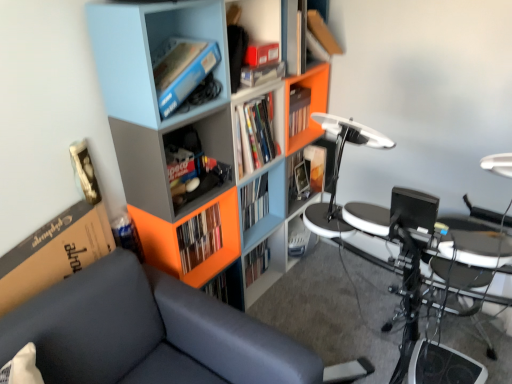
What is the approximate height of matte plastic book at center, the second book from the left?

It is 9.52 inches.

What are the coordinates of `matte plastic book at center, which appears as the 1th book when viewed from the right` in the screenshot? It's located at (316, 166).

What is the approximate height of matte blue bookshelf at upper left, which is the second shelf from bottom to top?

9.31 inches.

The image size is (512, 384). In order to click on matte cardboard box at upper center, which is the first shelf from top to bottom in this screenshot , I will do `click(260, 20)`.

Find the location of a particular element. metallic silver drum set at lower right is located at coordinates (417, 273).

The width and height of the screenshot is (512, 384). I want to click on matte plastic book at center, the second book from the left, so click(316, 166).

Does matte plastic cabinet at center have a smaller size compared to matte plastic bookcase at upper left?

Yes.

How many degrees apart are the facing directions of matte plastic cabinet at center and matte plastic bookcase at upper left?

The facing directions of matte plastic cabinet at center and matte plastic bookcase at upper left are 0.586 degrees apart.

Which point is more distant from viewer, (x=286, y=231) or (x=101, y=34)?

The point (x=286, y=231) is farther.

Is matte plastic cabinet at center not inside matte plastic bookcase at upper left?

That's incorrect, matte plastic cabinet at center is not completely outside matte plastic bookcase at upper left.

Looking at this image, considering the sizes of dark gray fabric couch at left and matte plastic bookcase at upper left in the image, is dark gray fabric couch at left taller or shorter than matte plastic bookcase at upper left?

Clearly, dark gray fabric couch at left is shorter compared to matte plastic bookcase at upper left.

Which object is wider, dark gray fabric couch at left or matte plastic bookcase at upper left?

dark gray fabric couch at left.

From a real-world perspective, does dark gray fabric couch at left sit lower than matte plastic bookcase at upper left?

Yes, from a real-world perspective, dark gray fabric couch at left is under matte plastic bookcase at upper left.

Is matte plastic book at center, the second book from the left, placed right next to orange matte bookshelf at center, placed as the 2th book when sorted from back to front?

No, matte plastic book at center, the second book from the left, is not making contact with orange matte bookshelf at center, placed as the 2th book when sorted from back to front.

Considering the relative sizes of matte plastic book at center, the second book from the left, and orange matte bookshelf at center, the first book ordered from the bottom, in the image provided, is matte plastic book at center, the second book from the left, shorter than orange matte bookshelf at center, the first book ordered from the bottom,?

Yes, matte plastic book at center, the second book from the left, is shorter than orange matte bookshelf at center, the first book ordered from the bottom.

Is matte plastic book at center, which appears as the 1th book when viewed from the right, wider than orange matte bookshelf at center, which ranks as the 1th book in left-to-right order?

Yes, matte plastic book at center, which appears as the 1th book when viewed from the right, is wider than orange matte bookshelf at center, which ranks as the 1th book in left-to-right order.

Is matte plastic book at center, the second book from the left, looking in the opposite direction of orange matte bookshelf at center, which ranks as the 1th book in left-to-right order?

matte plastic book at center, the second book from the left, is not turned away from orange matte bookshelf at center, which ranks as the 1th book in left-to-right order.

Considering the positions of objects metallic silver drum set at lower right and dark gray fabric couch at left in the image provided, who is in front, metallic silver drum set at lower right or dark gray fabric couch at left?

dark gray fabric couch at left.

Looking at the image, does metallic silver drum set at lower right seem bigger or smaller compared to dark gray fabric couch at left?

In the image, metallic silver drum set at lower right appears to be smaller than dark gray fabric couch at left.

Is dark gray fabric couch at left completely or partially inside metallic silver drum set at lower right?

No, dark gray fabric couch at left is not a part of metallic silver drum set at lower right.

Can you tell me how much dark gray fabric couch at left and matte plastic cabinet at center differ in facing direction?

The angle between the facing direction of dark gray fabric couch at left and the facing direction of matte plastic cabinet at center is 1.5 degrees.

From the image's perspective, which object appears higher, dark gray fabric couch at left or matte plastic cabinet at center?

matte plastic cabinet at center appears higher in the image.

Which is correct: dark gray fabric couch at left is inside matte plastic cabinet at center, or outside of it?

dark gray fabric couch at left is not enclosed by matte plastic cabinet at center.

At what (x,y) coordinates should I click in order to perform the action: click on chair on the left of matte plastic cabinet at center. Please return your answer as a coordinate pair (x, y). This screenshot has width=512, height=384. Looking at the image, I should click on (148, 333).

Is the position of orange matte bookshelf at center, the 1th book positioned from the front, less distant than that of metallic silver drum set at lower right?

No.

Considering the relative sizes of orange matte bookshelf at center, the first book ordered from the bottom, and metallic silver drum set at lower right in the image provided, is orange matte bookshelf at center, the first book ordered from the bottom, taller than metallic silver drum set at lower right?

Indeed, orange matte bookshelf at center, the first book ordered from the bottom, has a greater height compared to metallic silver drum set at lower right.

Measure the distance from orange matte bookshelf at center, placed as the 2th book when sorted from back to front, to metallic silver drum set at lower right.

orange matte bookshelf at center, placed as the 2th book when sorted from back to front, and metallic silver drum set at lower right are 69.17 centimeters apart.

From the picture: Which object is thinner, orange matte bookshelf at center, placed as the 2th book when sorted from back to front, or metallic silver drum set at lower right?

With smaller width is orange matte bookshelf at center, placed as the 2th book when sorted from back to front.

Between matte plastic book at center, which is the first book from top to bottom, and matte cardboard box at upper center, the 3th shelf from the bottom, which one has larger size?

Bigger between the two is matte cardboard box at upper center, the 3th shelf from the bottom.

Does point (310, 180) lie in front of point (256, 28)?

No, it is behind (256, 28).

Is matte plastic book at center, which is the first book from top to bottom, positioned with its back to matte cardboard box at upper center, which is the first shelf from top to bottom?

No.

Can we say matte plastic book at center, which is the first book from top to bottom, lies outside matte cardboard box at upper center, the 3th shelf from the bottom?

Yes, matte plastic book at center, which is the first book from top to bottom, is not within matte cardboard box at upper center, the 3th shelf from the bottom.

Where is `cabinet located behind the matte plastic bookcase at upper left`? cabinet located behind the matte plastic bookcase at upper left is located at coordinates (300, 233).

I want to click on bookcase that is above the dark gray fabric couch at left (from a real-world perspective), so (x=181, y=135).

From the image, which object appears to be farther from orange matte bookshelf at center, which ranks as the 1th book in left-to-right order, matte plastic shelf at center, the 1th shelf positioned from the bottom, or metallic silver drum set at lower right?

metallic silver drum set at lower right is positioned further to the anchor orange matte bookshelf at center, which ranks as the 1th book in left-to-right order.

When comparing their distances from matte plastic book at center, arranged as the 1th book when viewed from the back, does matte plastic shelf at center, which ranks as the 3th shelf in top-to-bottom order, or dark gray fabric couch at left seem further?

dark gray fabric couch at left lies further to matte plastic book at center, arranged as the 1th book when viewed from the back, than the other object.

Which object lies nearer to the anchor point matte plastic cabinet at center, matte plastic shelf at center, the 1th shelf positioned from the bottom, or orange matte bookshelf at center, the second book from the top?

Based on the image, orange matte bookshelf at center, the second book from the top, appears to be nearer to matte plastic cabinet at center.

From the image, which object appears to be farther from matte blue bookshelf at upper left, which is the second shelf from bottom to top, metallic silver drum set at lower right or dark gray fabric couch at left?

metallic silver drum set at lower right lies further to matte blue bookshelf at upper left, which is the second shelf from bottom to top, than the other object.

When comparing their distances from matte plastic book at center, which is the second book in bottom-to-top order, does dark gray fabric couch at left or orange matte bookshelf at center, the 2th book viewed from the right, seem closer?

orange matte bookshelf at center, the 2th book viewed from the right, is closer to matte plastic book at center, which is the second book in bottom-to-top order.

Based on their spatial positions, is metallic silver drum set at lower right or matte plastic book at center, which is the second book in bottom-to-top order, further from matte blue bookshelf at upper left, which is the second shelf from bottom to top?

Based on the image, matte plastic book at center, which is the second book in bottom-to-top order, appears to be further to matte blue bookshelf at upper left, which is the second shelf from bottom to top.

When comparing their distances from matte cardboard box at upper center, the 3th shelf from the bottom, does matte blue bookshelf at upper left, which is the second shelf from bottom to top, or matte plastic cabinet at center seem further?

Among the two, matte plastic cabinet at center is located further to matte cardboard box at upper center, the 3th shelf from the bottom.

Which object lies further to the anchor point matte plastic book at center, which appears as the 1th book when viewed from the right, metallic silver drum set at lower right or matte cardboard box at upper center, which is the first shelf from top to bottom?

metallic silver drum set at lower right is positioned further to the anchor matte plastic book at center, which appears as the 1th book when viewed from the right.

What are the coordinates of `computer desk between matte cardboard box at upper center, which is the first shelf from top to bottom, and dark gray fabric couch at left vertically` in the screenshot? It's located at (417, 273).

You are a GUI agent. You are given a task and a screenshot of the screen. Output one action in this format:
    pyautogui.click(x=<x>, y=<y>)
    Task: Click on the computer desk between dark gray fabric couch at left and matte plastic book at center, which is the second book in bottom-to-top order, in the front-back direction
    The height and width of the screenshot is (384, 512).
    Given the screenshot: What is the action you would take?
    pyautogui.click(x=417, y=273)

Where is `book positioned between dark gray fabric couch at left and matte plastic book at center, which is the second book in bottom-to-top order, from near to far`? This screenshot has height=384, width=512. book positioned between dark gray fabric couch at left and matte plastic book at center, which is the second book in bottom-to-top order, from near to far is located at coordinates (199, 238).

Locate an element on the screen. Image resolution: width=512 pixels, height=384 pixels. bookcase between matte blue bookshelf at upper left, which is the second shelf in top-to-bottom order, and orange matte bookshelf at center, the first book ordered from the bottom, in the vertical direction is located at coordinates (181, 135).